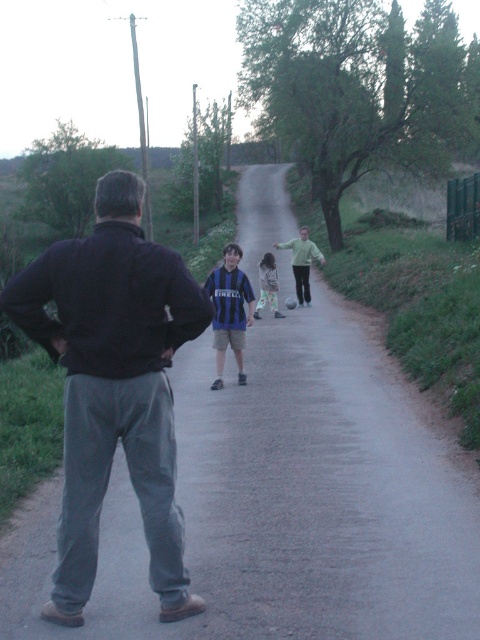
You are standing at point (264, 276) and want to walk to point (168, 440). Based on the scene description, is the path from your current position to the destination clear of any obstacles?

Yes, the path from point (264, 276) to point (168, 440) is clear because the scene describes a dirt road stretching into the distance with grassy areas and scattered wildflowers on the left and taller grasses and shrubs on the right, but there are no mentioned obstacles blocking the path between these two points.

You are a hiker who just arrived at this rural area. You need to cross the dirt road to reach the wildflowers on the left. The road is busy with cars. There is a safe crossing point 5 meters away from your current position. Can you safely cross the road before the dark gray sweatpants at center and blue striped jersey at center?

The distance between dark gray sweatpants at center and blue striped jersey at center is 6.67 meters. Since the safe crossing point is only 5 meters away, you can cross before reaching the dark gray sweatpants at center and blue striped jersey at center as the total distance to them is greater than the 5 meters required for the safe crossing.